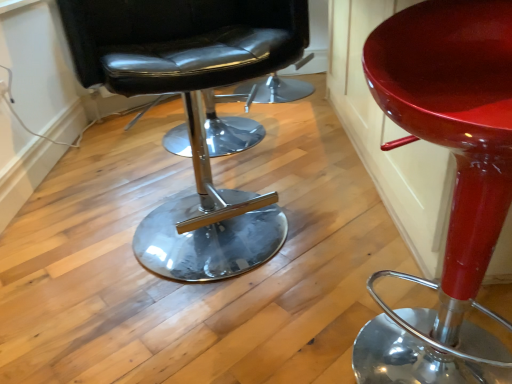
What are the coordinates of `blank area to the left of glossy red stool at center, placed as the second chair when sorted from left to right` in the screenshot? It's located at (266, 337).